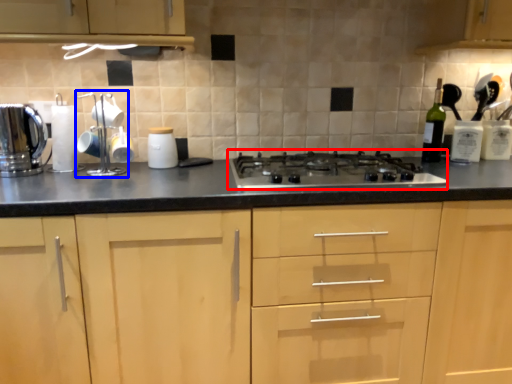
Question: Which point is closer to the camera, gas stove (highlighted by a red box) or appliance (highlighted by a blue box)?

Choices:
 (A) gas stove
 (B) appliance

Answer: (A)